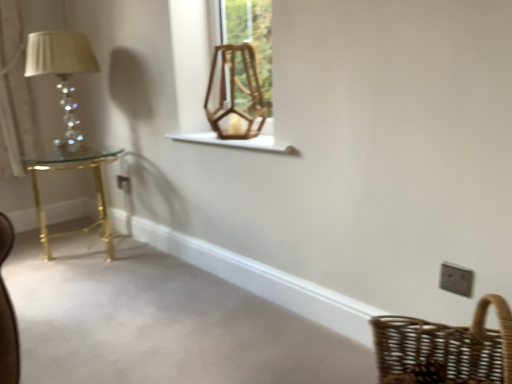
Question: Does white plastic/light switch at lower right have a larger size compared to gold metallic table at left?

Choices:
 (A) yes
 (B) no

Answer: (B)

Question: From the image's perspective, is white plastic/light switch at lower right below gold metallic table at left?

Choices:
 (A) yes
 (B) no

Answer: (A)

Question: Considering the relative sizes of white plastic/light switch at lower right and gold metallic table at left in the image provided, is white plastic/light switch at lower right wider than gold metallic table at left?

Choices:
 (A) no
 (B) yes

Answer: (A)

Question: Are white plastic/light switch at lower right and gold metallic table at left beside each other?

Choices:
 (A) no
 (B) yes

Answer: (A)

Question: Considering the relative sizes of white plastic/light switch at lower right and gold metallic table at left in the image provided, is white plastic/light switch at lower right shorter than gold metallic table at left?

Choices:
 (A) no
 (B) yes

Answer: (B)

Question: From a real-world perspective, is woven brown basket at lower right positioned above or below wooden swivel chair at upper center?

Choices:
 (A) above
 (B) below

Answer: (B)

Question: Do you think woven brown basket at lower right is within wooden swivel chair at upper center, or outside of it?

Choices:
 (A) inside
 (B) outside

Answer: (B)

Question: Would you say woven brown basket at lower right is to the left or to the right of wooden swivel chair at upper center in the picture?

Choices:
 (A) right
 (B) left

Answer: (A)

Question: In the image, is woven brown basket at lower right positioned in front of or behind wooden swivel chair at upper center?

Choices:
 (A) behind
 (B) front

Answer: (B)

Question: Choose the correct answer: Is white plastic/light switch at lower right inside woven brown basket at lower right or outside it?

Choices:
 (A) inside
 (B) outside

Answer: (B)

Question: Based on their sizes in the image, would you say white plastic/light switch at lower right is bigger or smaller than woven brown basket at lower right?

Choices:
 (A) small
 (B) big

Answer: (A)

Question: Considering the positions of white plastic/light switch at lower right and woven brown basket at lower right in the image, is white plastic/light switch at lower right taller or shorter than woven brown basket at lower right?

Choices:
 (A) tall
 (B) short

Answer: (B)

Question: From the image's perspective, is white plastic/light switch at lower right positioned above or below woven brown basket at lower right?

Choices:
 (A) below
 (B) above

Answer: (B)

Question: Looking at their shapes, would you say matte glass table lamp at left is wider or thinner than white wooden window sill at center?

Choices:
 (A) thin
 (B) wide

Answer: (B)

Question: Considering their positions, is matte glass table lamp at left located in front of or behind white wooden window sill at center?

Choices:
 (A) front
 (B) behind

Answer: (B)